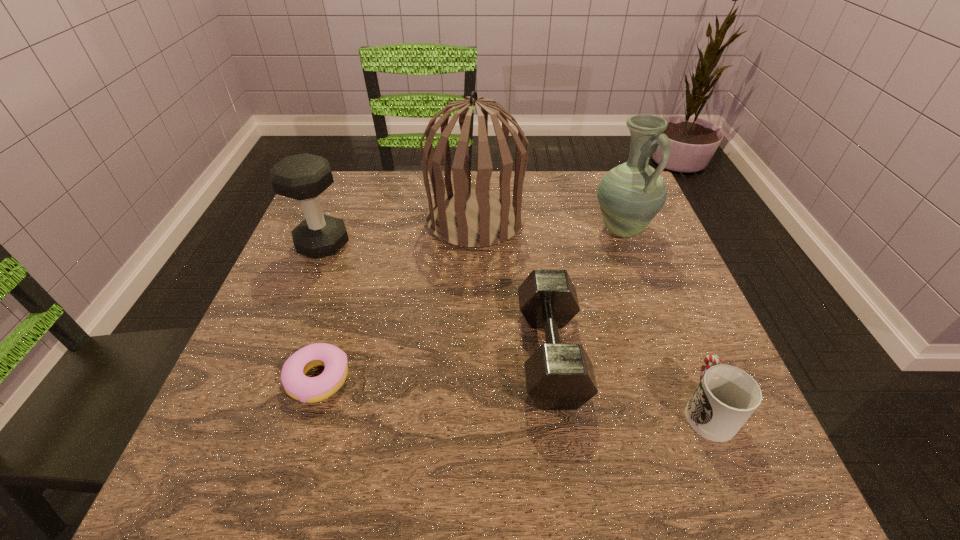
Find the location of a particular element. This screenshot has height=540, width=960. free spot located on the right of the taller dumbbell is located at coordinates (384, 245).

The width and height of the screenshot is (960, 540). I want to click on free region located 0.050m on the right of the shorter dumbbell, so click(608, 354).

This screenshot has width=960, height=540. Identify the location of vacant space located 0.280m on the side of the cup where the handle is located. (651, 271).

The height and width of the screenshot is (540, 960). What are the coordinates of `free space located 0.130m on the side of the cup where the handle is located` in the screenshot? It's located at (672, 323).

The image size is (960, 540). Identify the location of blank area located 0.380m on the side of the cup where the handle is located. (639, 242).

Identify the location of free space located on the right of the shortest object. (507, 379).

Locate an element on the screen. Image resolution: width=960 pixels, height=540 pixels. birdcage at the far edge is located at coordinates (473, 218).

Where is `pitcher present at the far edge`? Image resolution: width=960 pixels, height=540 pixels. pitcher present at the far edge is located at coordinates (630, 195).

Identify the location of object located in the near edge section of the desktop. This screenshot has height=540, width=960. (726, 397).

The width and height of the screenshot is (960, 540). Identify the location of dumbbell that is at the left edge. (303, 177).